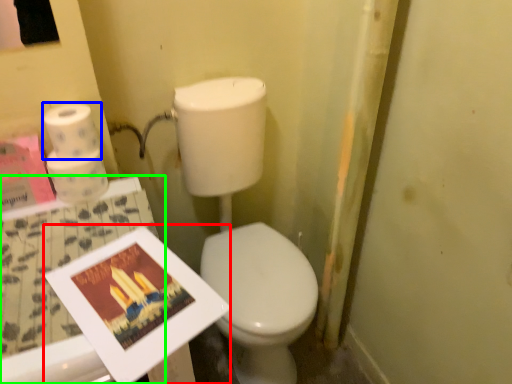
Question: Estimate the real-world distances between objects in this image. Which object is closer to magazine (highlighted by a red box), toilet paper (highlighted by a blue box) or table (highlighted by a green box)?

Choices:
 (A) toilet paper
 (B) table

Answer: (B)